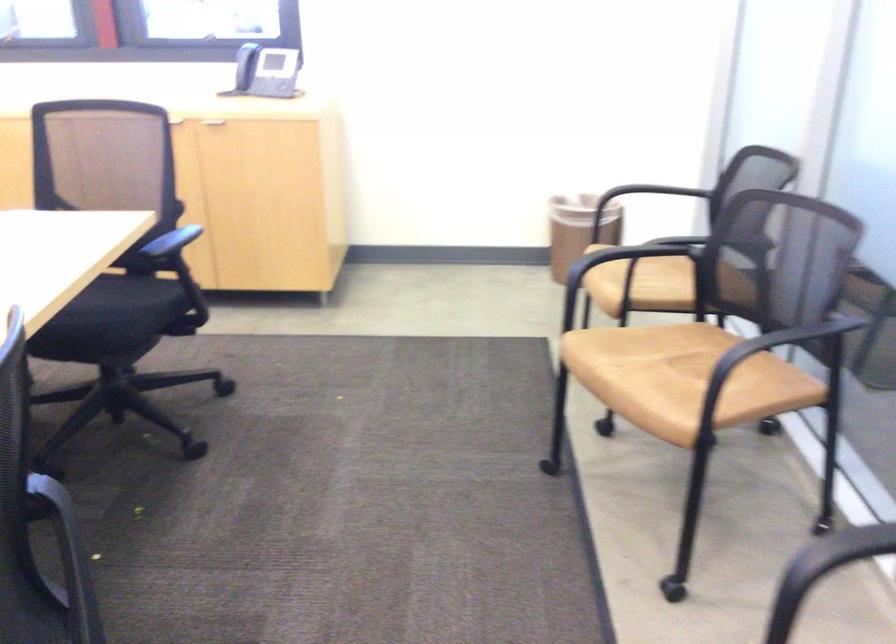
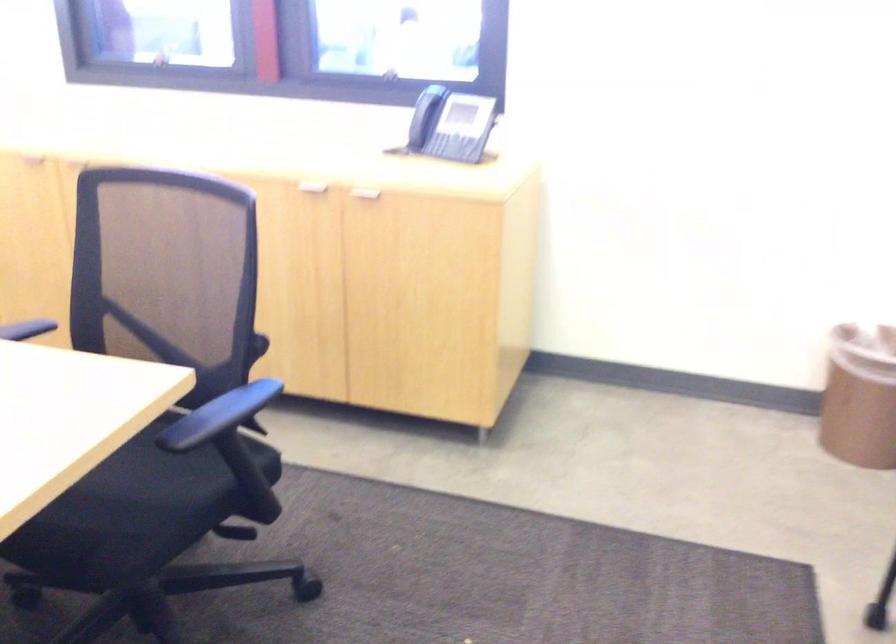
Find the pixel in the second image that matches point (213, 125) in the first image.

(364, 196)